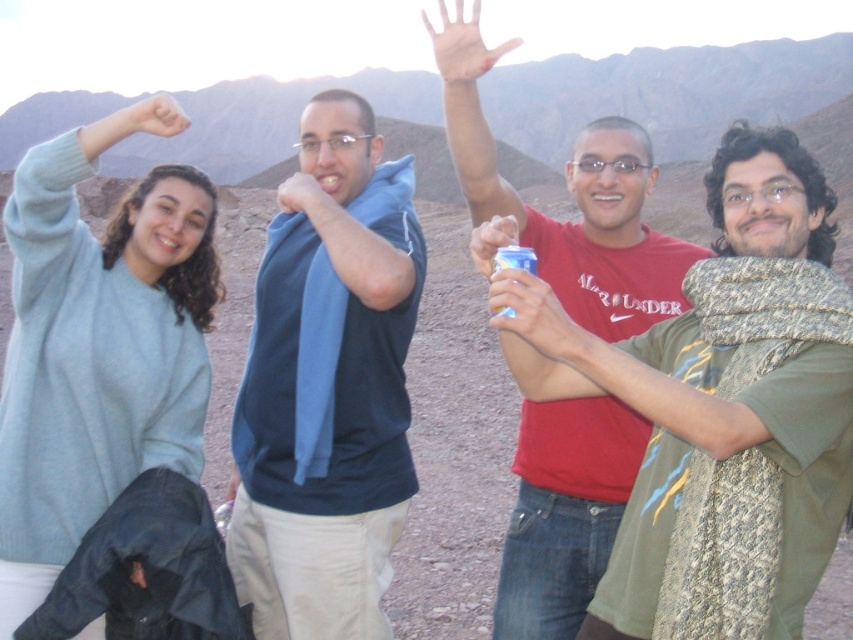
Question: Which object appears closest to the camera in this image?

Choices:
 (A) matte skin at upper left
 (B) dark blue fabric at center
 (C) light blue sweater at upper left
 (D) metallic can at center

Answer: (D)

Question: Which object appears farthest from the camera in this image?

Choices:
 (A) matte skin at upper left
 (B) matte blue shirt at center
 (C) light blue sweater at upper left
 (D) blue metallic can at center

Answer: (B)

Question: Does matte red t-shirt at center have a smaller size compared to matte blue shirt at center?

Choices:
 (A) no
 (B) yes

Answer: (A)

Question: Does light blue sweater at upper left have a greater width compared to blue metallic can at center?

Choices:
 (A) no
 (B) yes

Answer: (B)

Question: Does matte red t-shirt at center appear under white matte hand at upper center?

Choices:
 (A) no
 (B) yes

Answer: (B)

Question: Which object is farther from the camera taking this photo?

Choices:
 (A) blue metallic can at center
 (B) light blue sweater at upper left
 (C) matte skin at upper left

Answer: (C)